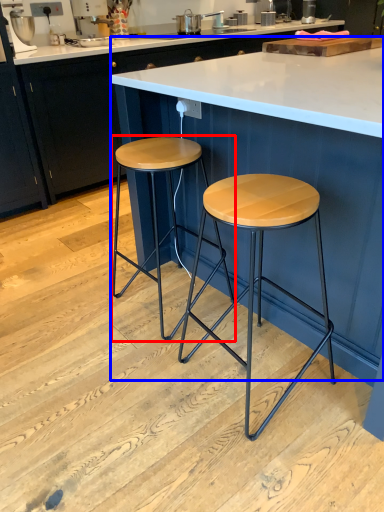
Question: Which point is closer to the camera, stool (highlighted by a red box) or table (highlighted by a blue box)?

Choices:
 (A) stool
 (B) table

Answer: (B)